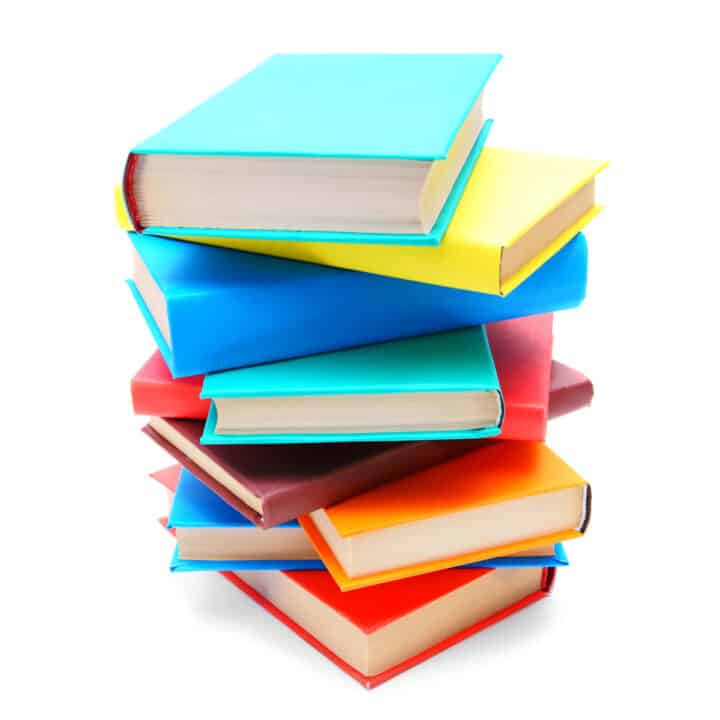
Where is `books`? books is located at coordinates (354, 120), (474, 179), (328, 299), (330, 399), (148, 396), (194, 444), (373, 516), (256, 534), (307, 587).